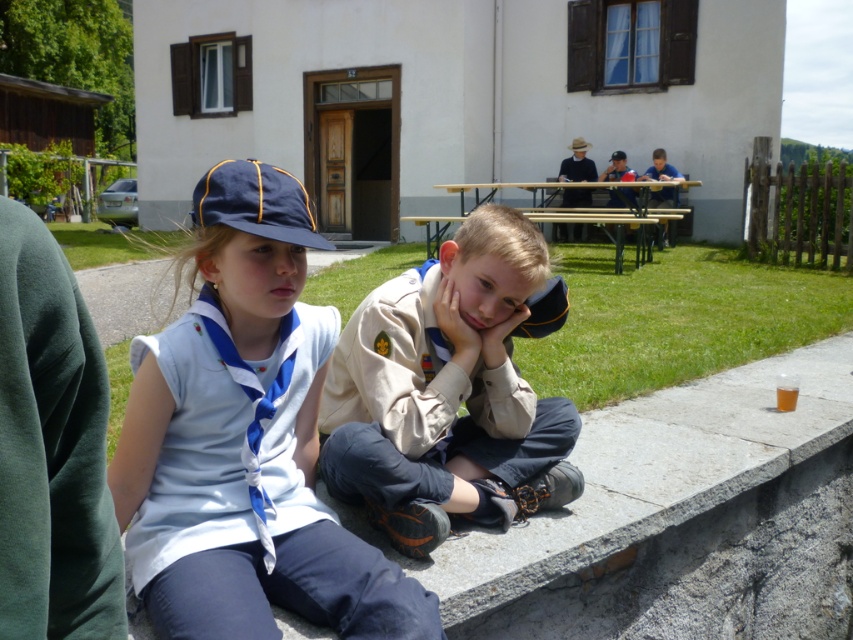
Question: Does tan fabric uniform at center have a smaller size compared to wooden picnic table at center?

Choices:
 (A) no
 (B) yes

Answer: (B)

Question: Which object appears farthest from the camera in this image?

Choices:
 (A) tan fabric uniform at center
 (B) wooden picnic table at center

Answer: (B)

Question: In this image, where is white cotton shirt at center located relative to wooden picnic table at center?

Choices:
 (A) below
 (B) above

Answer: (A)

Question: Can you confirm if tan fabric uniform at center is bigger than wooden picnic table at center?

Choices:
 (A) no
 (B) yes

Answer: (A)

Question: Which of these objects is positioned farthest from the tan fabric uniform at center?

Choices:
 (A) white cotton shirt at center
 (B) wooden picnic table at center

Answer: (B)

Question: Which point is closer to the camera?

Choices:
 (A) white cotton shirt at center
 (B) tan fabric uniform at center

Answer: (A)